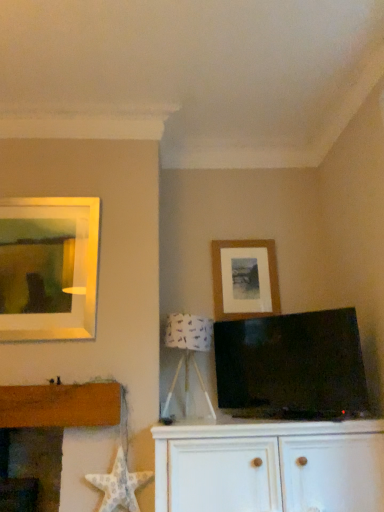
Question: From the image's perspective, is white fabric lampshade at center under white wood cabinet at center?

Choices:
 (A) yes
 (B) no

Answer: (B)

Question: Considering the relative positions of white fabric lampshade at center and white wood cabinet at center in the image provided, is white fabric lampshade at center to the left of white wood cabinet at center from the viewer's perspective?

Choices:
 (A) no
 (B) yes

Answer: (B)

Question: Considering the relative sizes of white fabric lampshade at center and white wood cabinet at center in the image provided, is white fabric lampshade at center wider than white wood cabinet at center?

Choices:
 (A) yes
 (B) no

Answer: (B)

Question: Is white fabric lampshade at center not inside white wood cabinet at center?

Choices:
 (A) yes
 (B) no

Answer: (A)

Question: From a real-world perspective, is white fabric lampshade at center physically below white wood cabinet at center?

Choices:
 (A) no
 (B) yes

Answer: (A)

Question: Does white fabric lampshade at center have a lesser height compared to white wood cabinet at center?

Choices:
 (A) no
 (B) yes

Answer: (A)

Question: Considering the relative positions of white wood cabinet at center and wooden picture frame at upper right in the image provided, is white wood cabinet at center to the right of wooden picture frame at upper right from the viewer's perspective?

Choices:
 (A) no
 (B) yes

Answer: (B)

Question: Is white wood cabinet at center wider than wooden picture frame at upper right?

Choices:
 (A) yes
 (B) no

Answer: (A)

Question: From a real-world perspective, is white wood cabinet at center positioned over wooden picture frame at upper right based on gravity?

Choices:
 (A) no
 (B) yes

Answer: (A)

Question: Are white wood cabinet at center and wooden picture frame at upper right making contact?

Choices:
 (A) yes
 (B) no

Answer: (B)

Question: From the image's perspective, does white wood cabinet at center appear lower than wooden picture frame at upper right?

Choices:
 (A) yes
 (B) no

Answer: (A)

Question: Considering the relative sizes of white wood cabinet at center and wooden picture frame at upper right in the image provided, is white wood cabinet at center smaller than wooden picture frame at upper right?

Choices:
 (A) no
 (B) yes

Answer: (A)

Question: Considering the relative sizes of wooden picture frame at upper right and white wood cabinet at center in the image provided, is wooden picture frame at upper right taller than white wood cabinet at center?

Choices:
 (A) yes
 (B) no

Answer: (A)